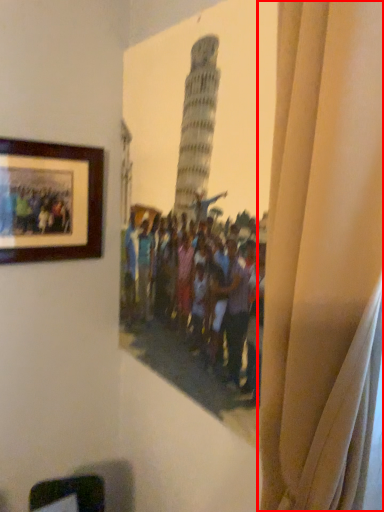
Question: From the image's perspective, where is curtain (annotated by the red box) located in relation to picture frame in the image?

Choices:
 (A) above
 (B) below

Answer: (B)